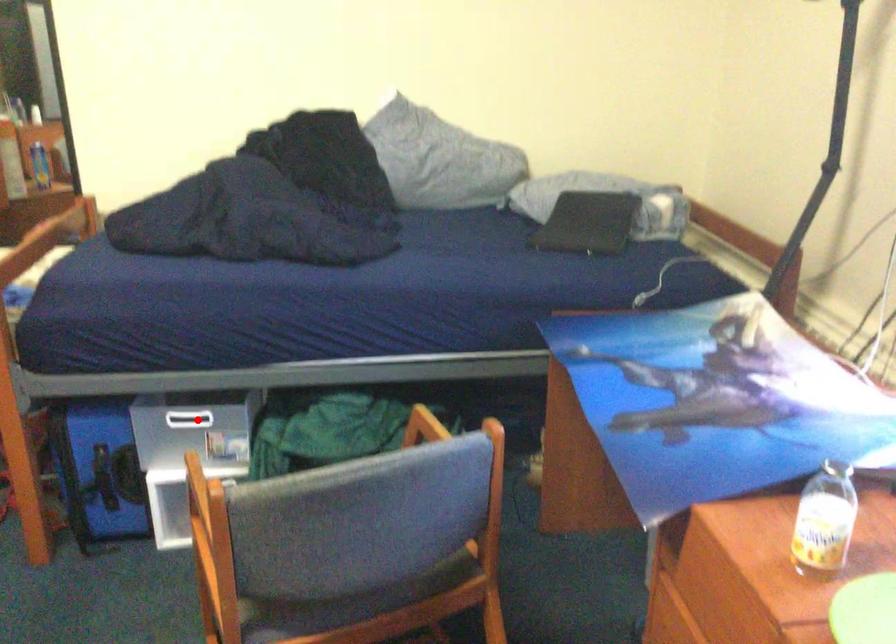
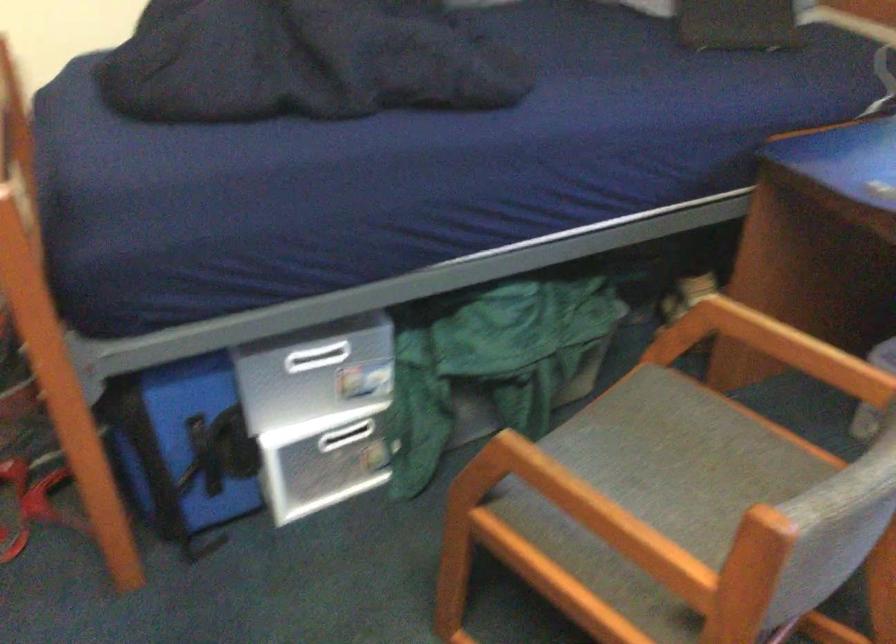
In the second image, find the point that corresponds to the highlighted location in the first image.

(326, 355)